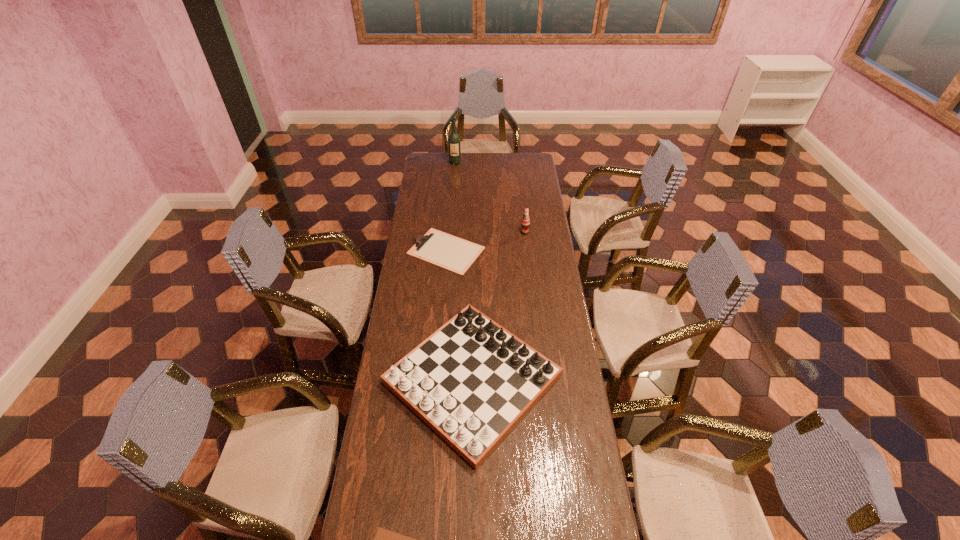
In order to click on vacant area between the wine bottle and the soda in this screenshot , I will do `click(490, 198)`.

Where is `free space between the soda and the gameboard`? This screenshot has height=540, width=960. free space between the soda and the gameboard is located at coordinates [x=498, y=306].

The image size is (960, 540). Identify the location of empty location between the soda and the fourth farthest object. (498, 306).

Locate which object is the fourth closest to the wine bottle. Please provide its 2D coordinates. Your answer should be formatted as a tuple, i.e. [(x, y)], where the tuple contains the x and y coordinates of a point satisfying the conditions above.

[(384, 539)]

Select which object is the fourth closest to the taller clipboard. Please provide its 2D coordinates. Your answer should be formatted as a tuple, i.e. [(x, y)], where the tuple contains the x and y coordinates of a point satisfying the conditions above.

[(384, 539)]

In order to click on free space in the image that satisfies the following two spatial constraints: 1. on the labeled side of the soda; 2. on the left side of the wine bottle in this screenshot , I will do `click(450, 232)`.

This screenshot has width=960, height=540. What are the coordinates of `free spot that satisfies the following two spatial constraints: 1. on the labeled side of the soda; 2. on the left side of the wine bottle` in the screenshot? It's located at (450, 232).

Where is `free region that satisfies the following two spatial constraints: 1. on the labeled side of the tallest object; 2. on the right side of the second nearest object`? free region that satisfies the following two spatial constraints: 1. on the labeled side of the tallest object; 2. on the right side of the second nearest object is located at coordinates (439, 380).